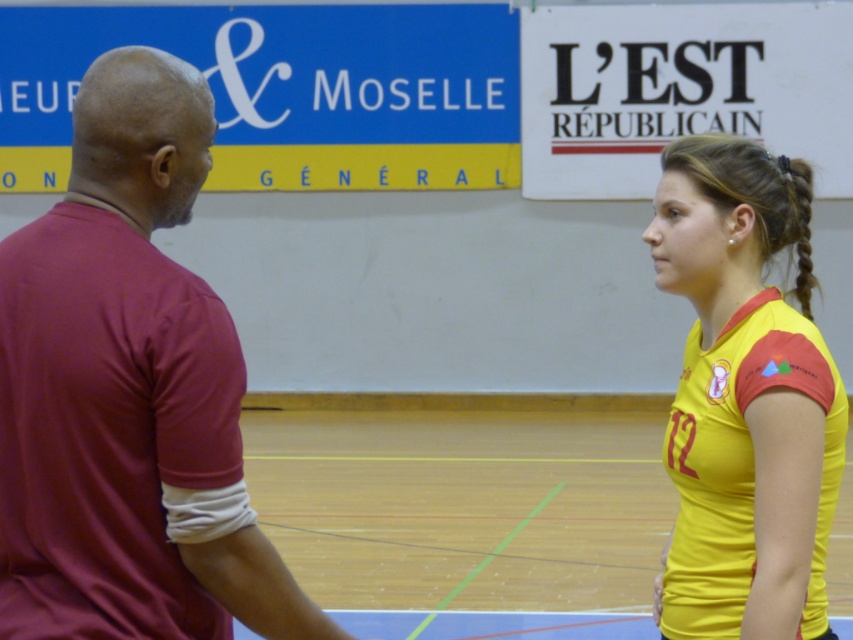
Who is higher up, maroon jersey at left or yellow jersey at right?

maroon jersey at left is above.

In the scene shown: Between maroon jersey at left and yellow jersey at right, which one has more height?

Standing taller between the two is maroon jersey at left.

Who is more distant from viewer, (170, 390) or (740, 428)?

The point (740, 428) is more distant.

At what (x,y) coordinates should I click in order to perform the action: click on maroon jersey at left. Please return your answer as a coordinate pair (x, y). The width and height of the screenshot is (853, 640). Looking at the image, I should click on (128, 394).